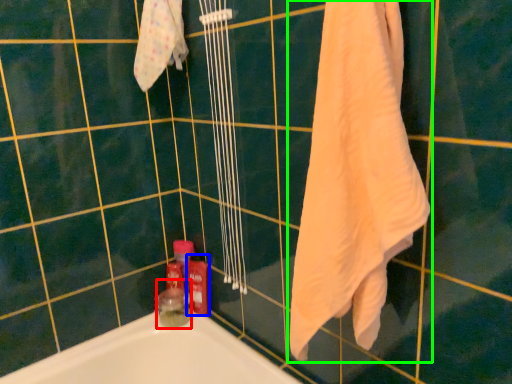
Question: Which object is the closest to the toiletry (highlighted by a red box)? Choose among these: cleaning product (highlighted by a blue box) or towel (highlighted by a green box).

Choices:
 (A) cleaning product
 (B) towel

Answer: (A)